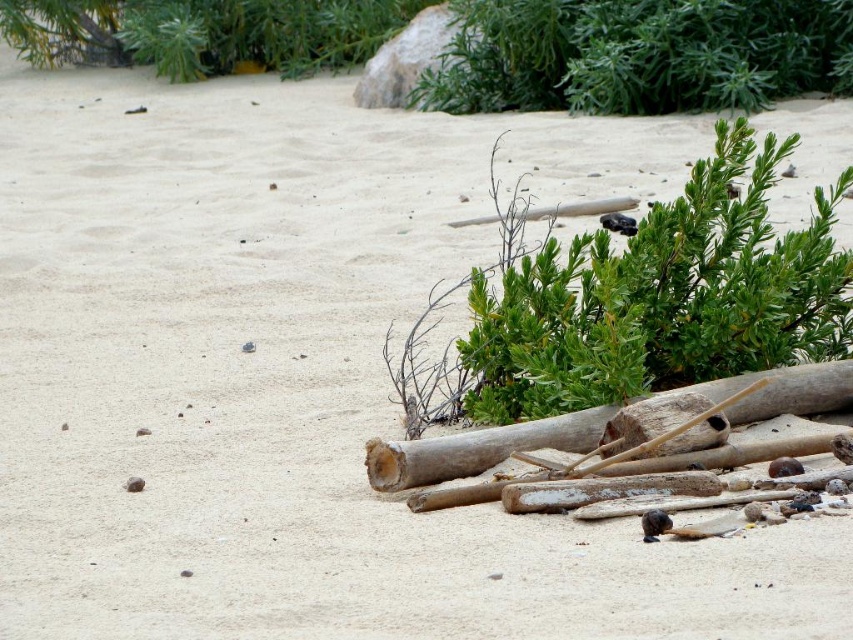
You are standing on the sandy beach and see the green leafy bush at upper center and the white weathered log at lower right. Which object is positioned higher up in the image?

The green leafy bush at upper center is positioned higher up in the image than the white weathered log at lower right.

Looking at this image, you are standing at the origin of the coordinate system in the beach scene. You see two points marked on the sand. Which point is closer to you, point (555, 108) or point (421, 481)?

Point (421, 481) is closer to you because the description states that point (555, 108) is behind point (421, 481).

You are a hiker who wants to take a photo of the green leafy bush at upper center and the white weathered log at lower right. Which object should you focus on first if you want to capture both in one frame without moving the camera?

The green leafy bush at upper center is taller than the white weathered log at lower right, so you should focus on the taller green leafy bush at upper center first to ensure it fits within the frame.